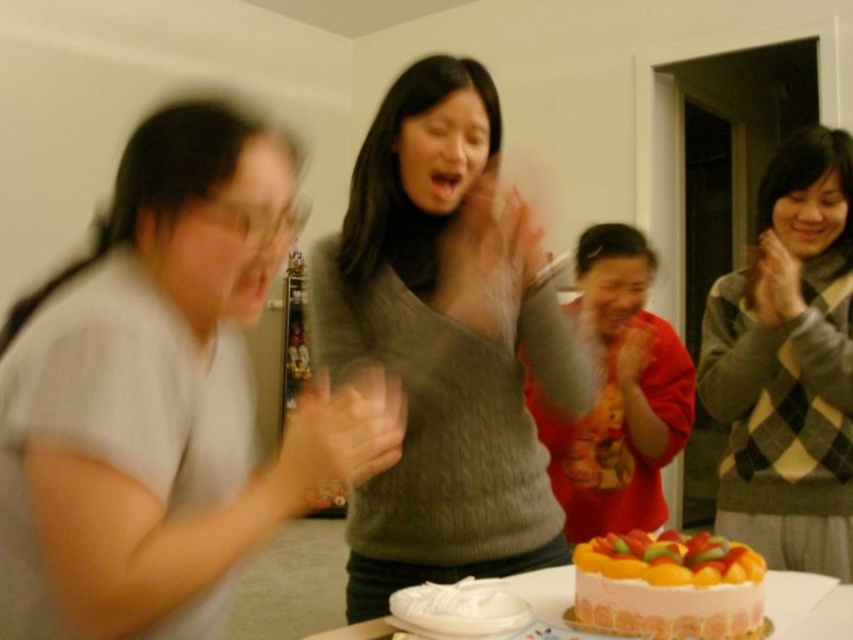
Based on the photo, you are a guest at the birthday party and want to grab a slice of the pink frosted cake at lower center. However, there is a knitted gray sweater at center in the way. Can you reach the cake without moving the sweater?

The knitted gray sweater at center is located above the pink frosted cake at lower center, so you can still reach the cake without moving the sweater since it is below the sweater.

Consider the image. You are at a birthday party and see the knitted gray sweater at center and the pink frosted cake at lower center. Which object is positioned to the left of the other?

The knitted gray sweater at center is to the left of the pink frosted cake at lower center.